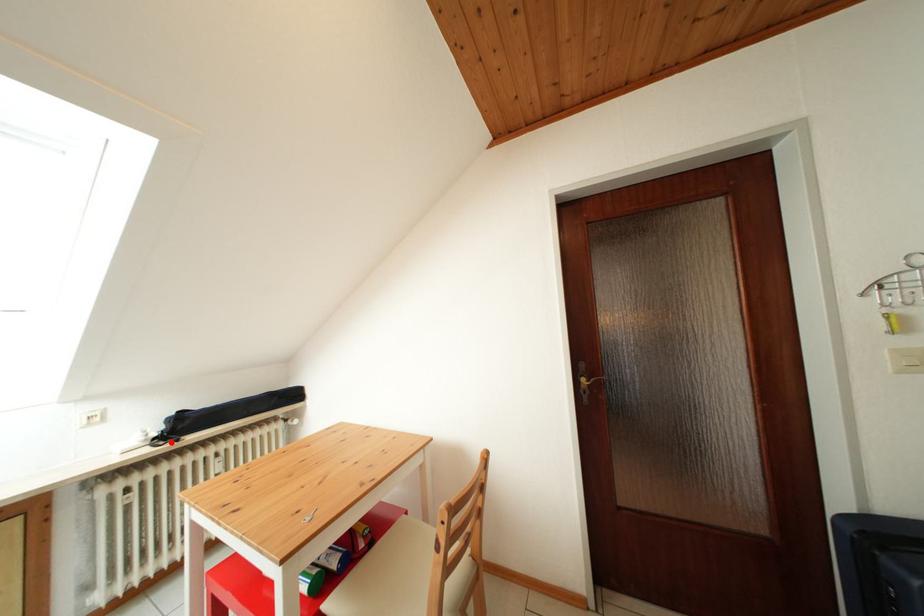
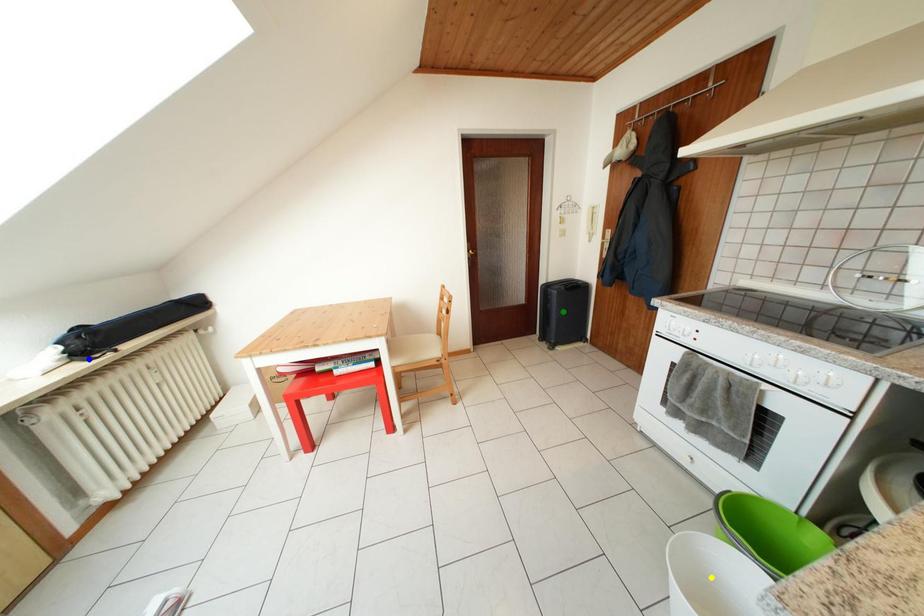
Question: I am providing you with two images of the same scene from different viewpoints. A red point is marked on the first image. You are given multiple points on the second image. Which spot in image 2 lines up with the point in image 1?

Choices:
 (A) green point
 (B) yellow point
 (C) blue point

Answer: (C)